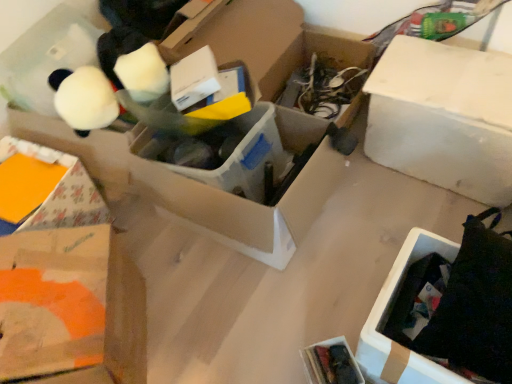
Where is `black cardboard box at lower right`? black cardboard box at lower right is located at coordinates (386, 314).

The image size is (512, 384). Describe the element at coordinates (386, 314) in the screenshot. I see `black cardboard box at lower right` at that location.

Find the location of a particular element. The image size is (512, 384). white matte box at upper right is located at coordinates (443, 117).

The image size is (512, 384). What do you see at coordinates (443, 117) in the screenshot?
I see `white matte box at upper right` at bounding box center [443, 117].

The width and height of the screenshot is (512, 384). I want to click on black cardboard box at lower right, so click(386, 314).

Does black cardboard box at lower right appear on the left side of white matte box at upper right?

Yes.

Based on the photo, which object is more forward, black cardboard box at lower right or white matte box at upper right?

black cardboard box at lower right.

Between point (374, 307) and point (449, 161), which one is positioned behind?

Point (449, 161)

From the image's perspective, who appears lower, black cardboard box at lower right or white matte box at upper right?

black cardboard box at lower right, from the image's perspective.

From a real-world perspective, is black cardboard box at lower right above or below white matte box at upper right?

black cardboard box at lower right is below white matte box at upper right.

Which of these two, black cardboard box at lower right or white matte box at upper right, is wider?

black cardboard box at lower right.

Considering the relative sizes of black cardboard box at lower right and white matte box at upper right in the image provided, is black cardboard box at lower right shorter than white matte box at upper right?

Yes, black cardboard box at lower right is shorter than white matte box at upper right.

Looking at the image, does black cardboard box at lower right seem bigger or smaller compared to white matte box at upper right?

Considering their sizes, black cardboard box at lower right takes up less space than white matte box at upper right.

Is black cardboard box at lower right inside the boundaries of white matte box at upper right, or outside?

black cardboard box at lower right is spatially situated outside white matte box at upper right.

Based on the photo, are black cardboard box at lower right and white matte box at upper right located far from each other?

No, black cardboard box at lower right is not far away from white matte box at upper right.

Is black cardboard box at lower right facing away from white matte box at upper right?

That's right, black cardboard box at lower right is facing away from white matte box at upper right.

How many degrees apart are the facing directions of black cardboard box at lower right and white matte box at upper right?

3.96 degrees separate the facing orientations of black cardboard box at lower right and white matte box at upper right.

Measure the distance from black cardboard box at lower right to white matte box at upper right.

A distance of 21.73 inches exists between black cardboard box at lower right and white matte box at upper right.

Locate an element on the screen. The height and width of the screenshot is (384, 512). cardboard box in front of the white matte box at upper right is located at coordinates (386, 314).

Which is more to the left, white matte box at upper right or black cardboard box at lower right?

black cardboard box at lower right.

Considering the relative positions of white matte box at upper right and black cardboard box at lower right in the image provided, is white matte box at upper right behind black cardboard box at lower right?

Yes, it is.

Does point (425, 123) appear closer or farther from the camera than point (443, 368)?

Point (425, 123) is farther from the camera than point (443, 368).

Looking at this image, from the image's perspective, is white matte box at upper right located above or below black cardboard box at lower right?

white matte box at upper right is above black cardboard box at lower right.

From a real-world perspective, who is located higher, white matte box at upper right or black cardboard box at lower right?

white matte box at upper right.

Is white matte box at upper right wider than black cardboard box at lower right?

Incorrect, the width of white matte box at upper right does not surpass that of black cardboard box at lower right.

Is white matte box at upper right taller or shorter than black cardboard box at lower right?

white matte box at upper right is taller than black cardboard box at lower right.

Can you confirm if white matte box at upper right is bigger than black cardboard box at lower right?

Yes, white matte box at upper right is bigger than black cardboard box at lower right.

Is white matte box at upper right surrounding black cardboard box at lower right?

Actually, black cardboard box at lower right is outside white matte box at upper right.

Is white matte box at upper right positioned far away from black cardboard box at lower right?

They are positioned close to each other.

Could you tell me if white matte box at upper right is facing black cardboard box at lower right?

Yes, white matte box at upper right is facing black cardboard box at lower right.

In the scene shown: How different are the orientations of white matte box at upper right and black cardboard box at lower right in degrees?

3.96 degrees separate the facing orientations of white matte box at upper right and black cardboard box at lower right.

What are the coordinates of `box behind the black cardboard box at lower right` in the screenshot? It's located at click(x=443, y=117).

You are a GUI agent. You are given a task and a screenshot of the screen. Output one action in this format:
    pyautogui.click(x=<x>, y=<y>)
    Task: Click on the cardboard box lying below the white matte box at upper right (from the image's perspective)
    
    Given the screenshot: What is the action you would take?
    pyautogui.click(x=386, y=314)

The image size is (512, 384). What are the coordinates of `box that is behind the black cardboard box at lower right` in the screenshot? It's located at (443, 117).